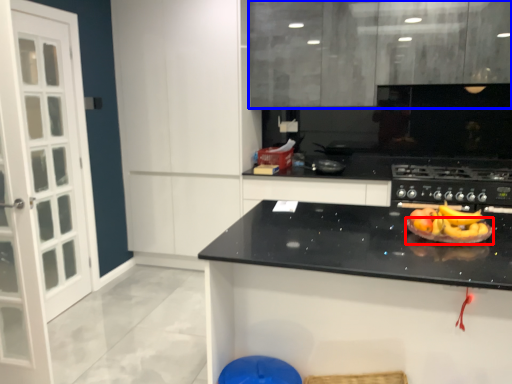
Question: Which object is closer to the camera taking this photo, paper plate (highlighted by a red box) or cabinetry (highlighted by a blue box)?

Choices:
 (A) paper plate
 (B) cabinetry

Answer: (A)